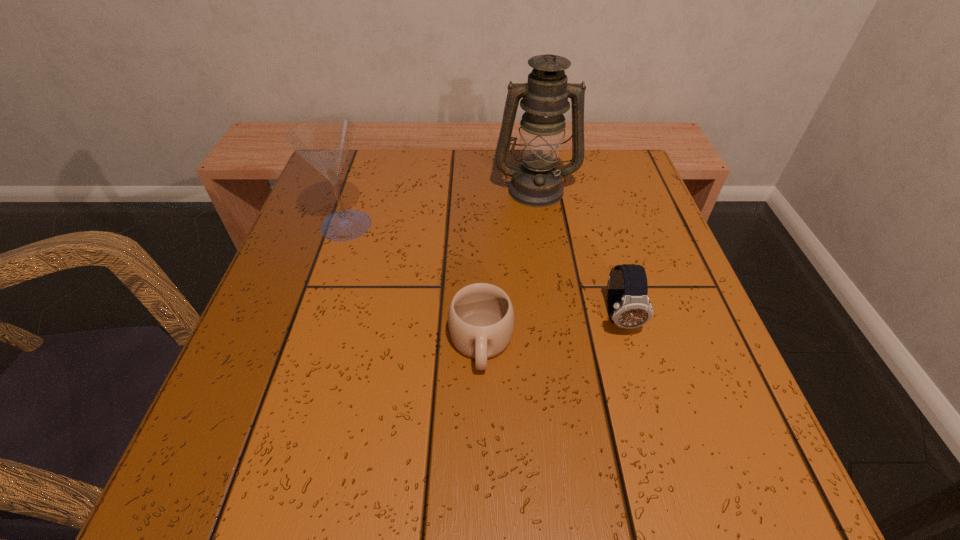
Where is `vacant space at the near right corner of the desktop`? Image resolution: width=960 pixels, height=540 pixels. vacant space at the near right corner of the desktop is located at coordinates (690, 458).

The height and width of the screenshot is (540, 960). Find the location of `vacant area that lies between the mug and the third shortest object`. vacant area that lies between the mug and the third shortest object is located at coordinates (414, 284).

Where is `free space between the oil lamp and the second tallest object`? The height and width of the screenshot is (540, 960). free space between the oil lamp and the second tallest object is located at coordinates (441, 207).

The image size is (960, 540). Find the location of `free point between the tallest object and the third tallest object`. free point between the tallest object and the third tallest object is located at coordinates point(578,253).

Identify the location of free area in between the tallest object and the third shortest object. The width and height of the screenshot is (960, 540). (441, 207).

Find the location of a particular element. empty space that is in between the tallest object and the watch is located at coordinates (578, 253).

I want to click on unoccupied area between the leftmost object and the second shortest object, so click(x=483, y=271).

Find the location of a particular element. This screenshot has height=540, width=960. vacant region between the shortest object and the third tallest object is located at coordinates (550, 330).

Where is `free spot between the tallest object and the mug`? Image resolution: width=960 pixels, height=540 pixels. free spot between the tallest object and the mug is located at coordinates (508, 266).

You are a GUI agent. You are given a task and a screenshot of the screen. Output one action in this format:
    pyautogui.click(x=<x>, y=<y>)
    Task: Click on the free spot between the mug and the second shortest object
    The height and width of the screenshot is (540, 960).
    Given the screenshot: What is the action you would take?
    pyautogui.click(x=550, y=330)